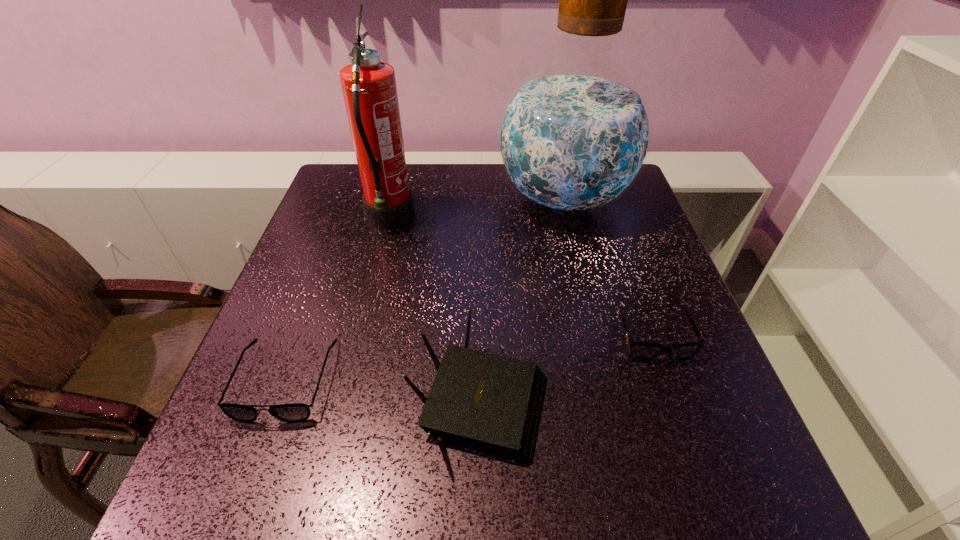
Locate an element on the screen. This screenshot has width=960, height=540. vacant point at the near edge is located at coordinates (508, 486).

At what (x,y) coordinates should I click in order to perform the action: click on free space at the left edge. Please return your answer as a coordinate pair (x, y). Looking at the image, I should click on (334, 254).

Identify the location of vacant area at the right edge. This screenshot has height=540, width=960. pos(623,220).

This screenshot has height=540, width=960. In order to click on vacant space in between the spectacles and the fire extinguisher in this screenshot , I will do `click(338, 301)`.

Find the location of `free space between the fire extinguisher and the spectacles`. free space between the fire extinguisher and the spectacles is located at coordinates (338, 301).

Identify the location of vacant area between the third tallest object and the sunglasses. Image resolution: width=960 pixels, height=540 pixels. (566, 366).

Where is `vacant area between the router and the fire extinguisher`? vacant area between the router and the fire extinguisher is located at coordinates (435, 308).

At what (x,y) coordinates should I click in order to perform the action: click on vacant area between the fire extinguisher and the router. Please return your answer as a coordinate pair (x, y). The image size is (960, 540). Looking at the image, I should click on (435, 308).

The height and width of the screenshot is (540, 960). Identify the location of vacant area that lies between the third tallest object and the fire extinguisher. (435, 308).

Locate an element on the screen. This screenshot has height=540, width=960. free space between the sunglasses and the water jug is located at coordinates (608, 267).